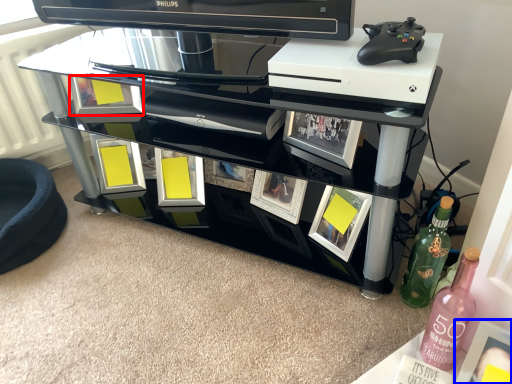
Question: Which object is further to the camera taking this photo, picture frame (highlighted by a red box) or picture frame (highlighted by a blue box)?

Choices:
 (A) picture frame
 (B) picture frame

Answer: (A)